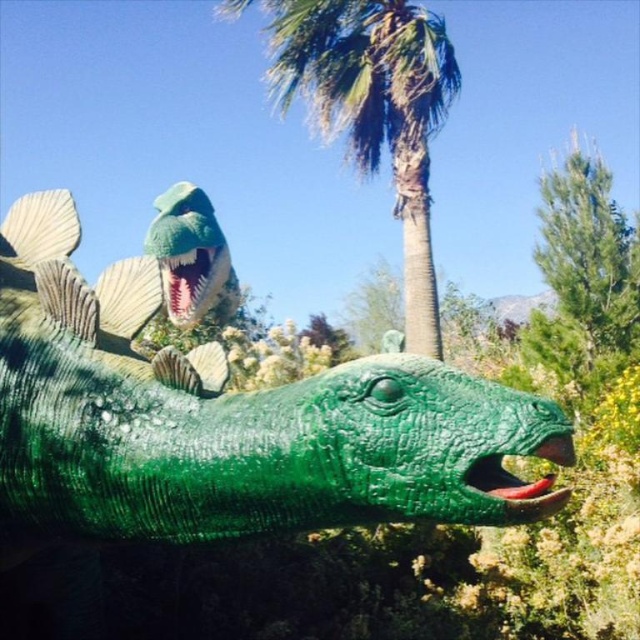
Question: Can you confirm if green glossy statue at center is positioned to the right of green textured palm tree at upper center?

Choices:
 (A) no
 (B) yes

Answer: (A)

Question: Does green glossy statue at center appear over green textured palm tree at upper center?

Choices:
 (A) yes
 (B) no

Answer: (B)

Question: Which of the following is the farthest from the observer?

Choices:
 (A) green textured palm tree at upper center
 (B) green glossy statue at center

Answer: (A)

Question: Is green glossy statue at center thinner than green textured palm tree at upper center?

Choices:
 (A) no
 (B) yes

Answer: (B)

Question: Which object is closer to the camera taking this photo?

Choices:
 (A) green textured palm tree at upper center
 (B) green glossy statue at center

Answer: (B)